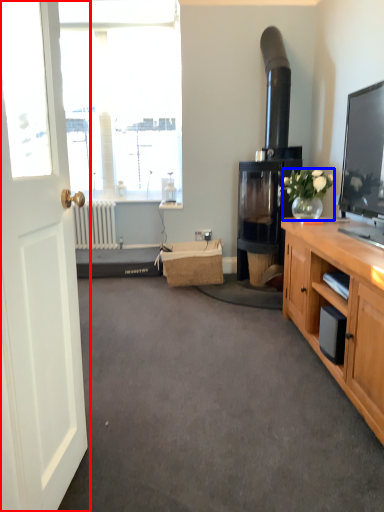
Question: Among these objects, which one is farthest to the camera, door (highlighted by a red box) or houseplant (highlighted by a blue box)?

Choices:
 (A) door
 (B) houseplant

Answer: (B)